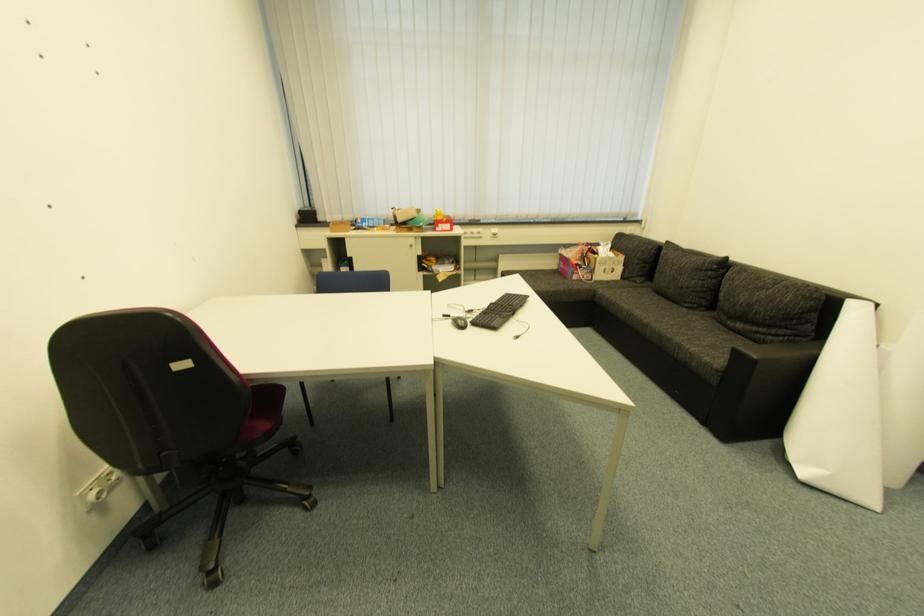
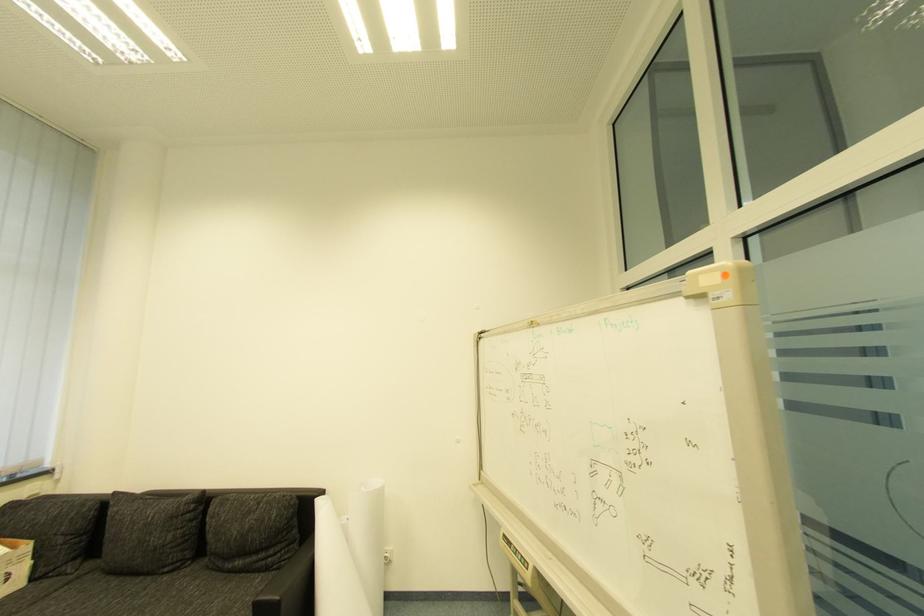
Question: The images are taken continuously from a first-person perspective. In which direction is your viewpoint rotating?

Choices:
 (A) Left
 (B) Right
 (C) Up
 (D) Down

Answer: (B)